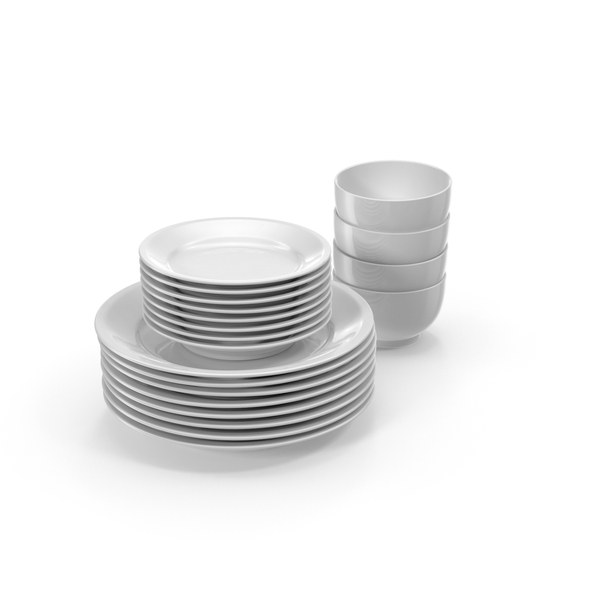
Identify the location of side plates. The height and width of the screenshot is (600, 600). (219, 283), (219, 291), (223, 301), (223, 310), (223, 316), (222, 327), (223, 337), (226, 345).